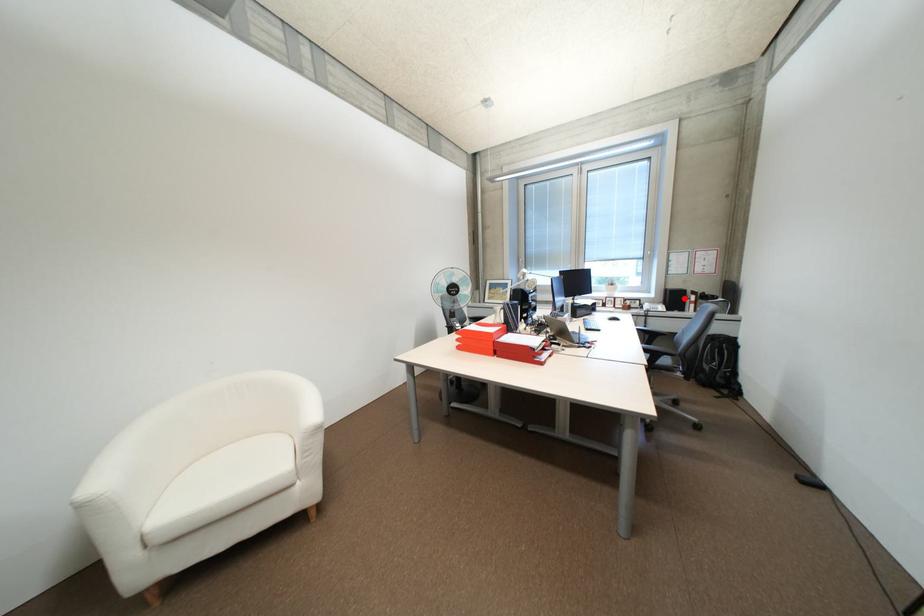
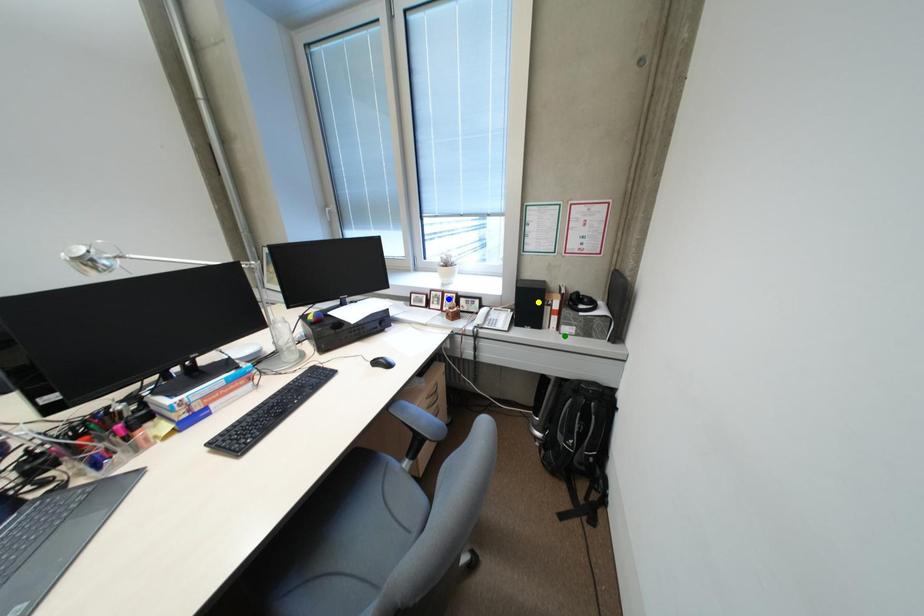
Question: I am providing you with two images of the same scene from different viewpoints. A red point is marked on the first image. You are given multiple points on the second image. Which spot in image 2 lines up with the point in image 1?

Choices:
 (A) yellow point
 (B) green point
 (C) blue point

Answer: (A)